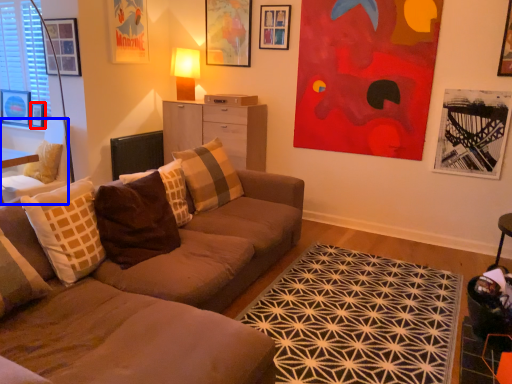
Question: Which of the following is the closest to the observer, picture frame (highlighted by a red box) or chair (highlighted by a blue box)?

Choices:
 (A) picture frame
 (B) chair

Answer: (B)